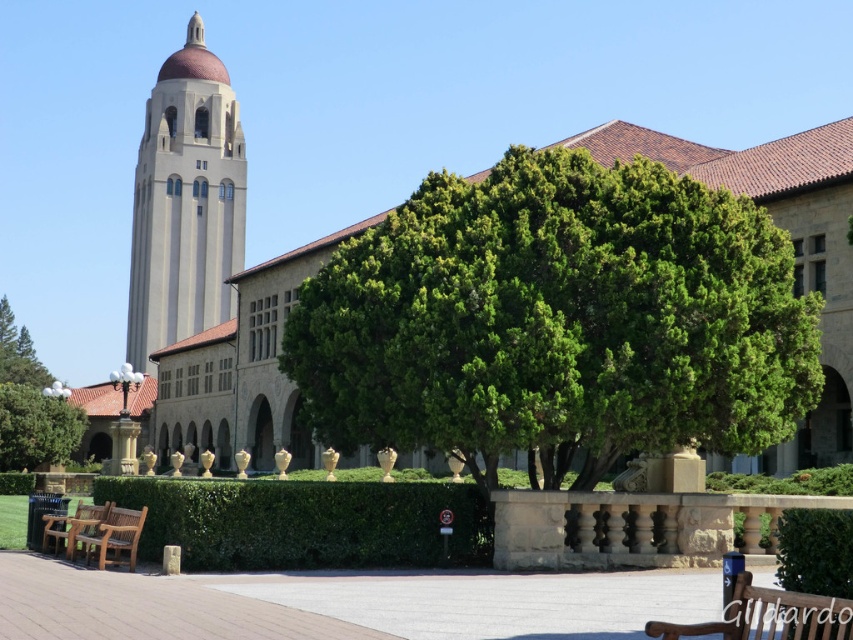
Question: Which of the following is the farthest from the observer?

Choices:
 (A) (805, 621)
 (B) (49, 454)
 (C) (131, 515)
 (D) (469, 508)

Answer: (B)

Question: Which point is closer to the camera?

Choices:
 (A) green leafy tree at center
 (B) green leafy tree at lower left

Answer: (A)

Question: Is green leafy hedge at center to the left of teak wood bench at lower left from the viewer's perspective?

Choices:
 (A) yes
 (B) no

Answer: (B)

Question: Is green leafy tree at lower left to the right of teak wood bench at lower left from the viewer's perspective?

Choices:
 (A) yes
 (B) no

Answer: (B)

Question: Which object appears closest to the camera in this image?

Choices:
 (A) green leafy hedge at center
 (B) green leafy tree at center
 (C) green leafy tree at lower left
 (D) smooth beige tower at center-left

Answer: (A)

Question: Can you confirm if green leafy hedge at center is positioned to the right of green leafy tree at lower left?

Choices:
 (A) no
 (B) yes

Answer: (B)